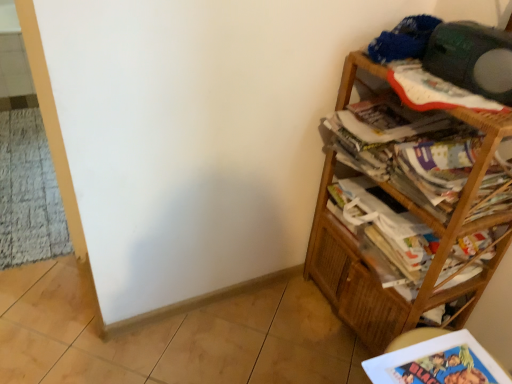
This screenshot has width=512, height=384. Describe the element at coordinates (406, 150) in the screenshot. I see `printed paper magazine at right, the first magazine when ordered from top to bottom` at that location.

This screenshot has width=512, height=384. Identify the location of printed paper magazine at right, the 1th magazine when ordered from bottom to top. (386, 231).

This screenshot has height=384, width=512. What do you see at coordinates (432, 260) in the screenshot?
I see `wooden bookcase at right` at bounding box center [432, 260].

At what (x,y) coordinates should I click in order to perform the action: click on printed paper magazine at right, the first magazine when ordered from top to bottom. Please return your answer as a coordinate pair (x, y). Image resolution: width=512 pixels, height=384 pixels. Looking at the image, I should click on (406, 150).

How many degrees apart are the facing directions of green matte speaker at upper right and white glossy book at lower right?

The angle between the facing direction of green matte speaker at upper right and the facing direction of white glossy book at lower right is 4.1 degrees.

Is green matte speaker at upper right positioned in front of white glossy book at lower right?

That is False.

Would you say green matte speaker at upper right contains white glossy book at lower right?

No, white glossy book at lower right is located outside of green matte speaker at upper right.

Which is more to the left, green matte speaker at upper right or white glossy book at lower right?

white glossy book at lower right.

From a real-world perspective, which object rests below the other?

white glossy book at lower right.

Is the surface of printed paper magazine at right, the first magazine when ordered from top to bottom, in direct contact with white glossy book at lower right?

No, printed paper magazine at right, the first magazine when ordered from top to bottom, is not touching white glossy book at lower right.

Is printed paper magazine at right, the first magazine when ordered from top to bottom, smaller than white glossy book at lower right?

No.

Between printed paper magazine at right, positioned as the second magazine in bottom-to-top order, and white glossy book at lower right, which one has smaller width?

With smaller width is white glossy book at lower right.

Based on the photo, is printed paper magazine at right, positioned as the second magazine in bottom-to-top order, smaller than printed paper magazine at right, the 1th magazine when ordered from bottom to top?

No.

Identify the location of magazine located on the left of printed paper magazine at right, the first magazine when ordered from top to bottom. (386, 231).

Which point is more forward, (x=426, y=149) or (x=422, y=256)?

The point (x=426, y=149) is more forward.

Is wooden bookcase at right beside white glossy book at lower right?

There is a gap between wooden bookcase at right and white glossy book at lower right.

Is wooden bookcase at right closer to camera compared to white glossy book at lower right?

No, wooden bookcase at right is further to the viewer.

From the image's perspective, which one is positioned higher, wooden bookcase at right or white glossy book at lower right?

From the image's view, wooden bookcase at right is above.

Is white glossy book at lower right to the left or to the right of wooden bookcase at right in the image?

white glossy book at lower right is to the left of wooden bookcase at right.

Between white glossy book at lower right and wooden bookcase at right, which one has smaller size?

Smaller between the two is white glossy book at lower right.

Does white glossy book at lower right come in front of wooden bookcase at right?

Yes, the depth of white glossy book at lower right is less than that of wooden bookcase at right.

Does white glossy book at lower right turn towards wooden bookcase at right?

No, white glossy book at lower right does not turn towards wooden bookcase at right.

Where is `speaker positioned vertically above the white glossy book at lower right (from a real-world perspective)`? This screenshot has width=512, height=384. speaker positioned vertically above the white glossy book at lower right (from a real-world perspective) is located at coordinates (472, 59).

From the image's perspective, is white glossy book at lower right beneath green matte speaker at upper right?

Correct, white glossy book at lower right appears lower than green matte speaker at upper right in the image.

Would you say white glossy book at lower right is to the left or to the right of green matte speaker at upper right in the picture?

In the image, white glossy book at lower right appears on the left side of green matte speaker at upper right.

Which object is further away from the camera taking this photo, white glossy book at lower right or green matte speaker at upper right?

green matte speaker at upper right is behind.

From a real-world perspective, is wooden bookcase at right located higher than printed paper magazine at right, the first magazine when ordered from top to bottom?

Incorrect, from a real-world perspective, wooden bookcase at right is lower than printed paper magazine at right, the first magazine when ordered from top to bottom.

From the image's perspective, is wooden bookcase at right on printed paper magazine at right, the first magazine when ordered from top to bottom?

Incorrect, from the image's perspective, wooden bookcase at right is lower than printed paper magazine at right, the first magazine when ordered from top to bottom.

Is wooden bookcase at right smaller than printed paper magazine at right, positioned as the second magazine in bottom-to-top order?

No, wooden bookcase at right is not smaller than printed paper magazine at right, positioned as the second magazine in bottom-to-top order.

I want to click on book below the green matte speaker at upper right (from the image's perspective), so click(437, 363).

Image resolution: width=512 pixels, height=384 pixels. I want to click on book that appears below the printed paper magazine at right, positioned as the second magazine in bottom-to-top order (from a real-world perspective), so click(437, 363).

From the picture: When comparing their distances from printed paper magazine at right, positioned as the second magazine in bottom-to-top order, does wooden bookcase at right or printed paper magazine at right, the 2th magazine positioned from the top, seem further?

wooden bookcase at right lies further to printed paper magazine at right, positioned as the second magazine in bottom-to-top order, than the other object.

Which object lies nearer to the anchor point green matte speaker at upper right, printed paper magazine at right, the 1th magazine when ordered from bottom to top, or printed paper magazine at right, positioned as the second magazine in bottom-to-top order?

Among the two, printed paper magazine at right, positioned as the second magazine in bottom-to-top order, is located nearer to green matte speaker at upper right.

From the image, which object appears to be nearer to printed paper magazine at right, the 2th magazine positioned from the top, wooden bookcase at right or green matte speaker at upper right?

The object closer to printed paper magazine at right, the 2th magazine positioned from the top, is wooden bookcase at right.

Considering their positions, is green matte speaker at upper right positioned closer to wooden bookcase at right than printed paper magazine at right, the first magazine when ordered from top to bottom?

printed paper magazine at right, the first magazine when ordered from top to bottom, is positioned closer to the anchor wooden bookcase at right.

From the picture: When comparing their distances from white glossy book at lower right, does printed paper magazine at right, the 1th magazine when ordered from bottom to top, or wooden bookcase at right seem further?

wooden bookcase at right is positioned further to the anchor white glossy book at lower right.

From the image, which object appears to be farther from green matte speaker at upper right, wooden bookcase at right or printed paper magazine at right, the first magazine when ordered from top to bottom?

Based on the image, wooden bookcase at right appears to be further to green matte speaker at upper right.

Consider the image. Considering their positions, is green matte speaker at upper right positioned closer to wooden bookcase at right than printed paper magazine at right, the 2th magazine positioned from the top?

Based on the image, printed paper magazine at right, the 2th magazine positioned from the top, appears to be nearer to wooden bookcase at right.

Estimate the real-world distances between objects in this image. Which object is further from green matte speaker at upper right, white glossy book at lower right or printed paper magazine at right, the 2th magazine positioned from the top?

white glossy book at lower right is further to green matte speaker at upper right.

Locate an element on the screen. magazine between wooden bookcase at right and printed paper magazine at right, the 1th magazine when ordered from bottom to top, in the front-back direction is located at coordinates (406, 150).

This screenshot has width=512, height=384. I want to click on bookcase that lies between green matte speaker at upper right and printed paper magazine at right, the 1th magazine when ordered from bottom to top, from top to bottom, so click(x=432, y=260).

You are a GUI agent. You are given a task and a screenshot of the screen. Output one action in this format:
    pyautogui.click(x=<x>, y=<y>)
    Task: Click on the magazine that lies between wooden bookcase at right and white glossy book at lower right from top to bottom
    This screenshot has width=512, height=384.
    Given the screenshot: What is the action you would take?
    pyautogui.click(x=386, y=231)

The height and width of the screenshot is (384, 512). I want to click on bookcase between green matte speaker at upper right and white glossy book at lower right from top to bottom, so click(x=432, y=260).